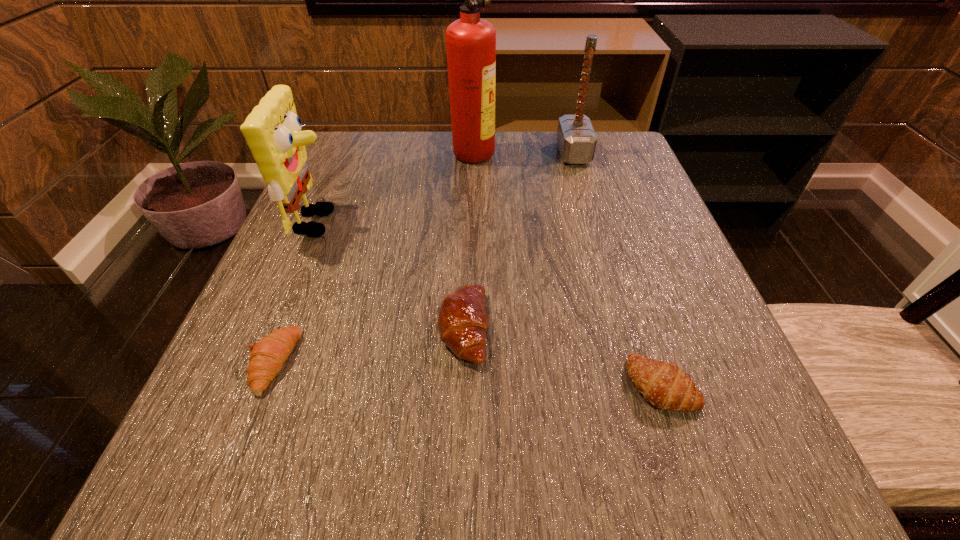
You are a GUI agent. You are given a task and a screenshot of the screen. Output one action in this format:
    pyautogui.click(x=<x>, y=<y>)
    Task: Click on the vacant area that lies between the second crescent roll from right to left and the hammer
    The height and width of the screenshot is (540, 960).
    Given the screenshot: What is the action you would take?
    pyautogui.click(x=518, y=241)

This screenshot has width=960, height=540. Find the location of `vacant space in between the fire extinguisher and the hammer`. vacant space in between the fire extinguisher and the hammer is located at coordinates (523, 152).

At what (x,y) coordinates should I click in order to perform the action: click on free spot between the tallest object and the rightmost crescent roll. Please return your answer as a coordinate pair (x, y). This screenshot has height=540, width=960. Looking at the image, I should click on (567, 268).

You are a GUI agent. You are given a task and a screenshot of the screen. Output one action in this format:
    pyautogui.click(x=<x>, y=<y>)
    Task: Click on the unoccupied area between the shortest object and the rightmost crescent roll
    The height and width of the screenshot is (540, 960).
    Given the screenshot: What is the action you would take?
    pyautogui.click(x=468, y=373)

What are the coordinates of `empty location between the shortest object and the hammer` in the screenshot? It's located at (423, 258).

What are the coordinates of `vacant point located between the rightmost crescent roll and the fire extinguisher` in the screenshot? It's located at (567, 268).

Find the location of a particular element. This screenshot has height=540, width=960. free space that is in between the leftmost crescent roll and the fire extinguisher is located at coordinates (372, 256).

Find the location of `vacant area that lies between the tallest object and the sponge`. vacant area that lies between the tallest object and the sponge is located at coordinates (396, 187).

Find the location of a particular element. The height and width of the screenshot is (540, 960). vacant area that lies between the shortest crescent roll and the hammer is located at coordinates (423, 258).

Locate which object ranks fifth in proximity to the hammer. Please provide its 2D coordinates. Your answer should be formatted as a tuple, i.e. [(x, y)], where the tuple contains the x and y coordinates of a point satisfying the conditions above.

[(268, 355)]